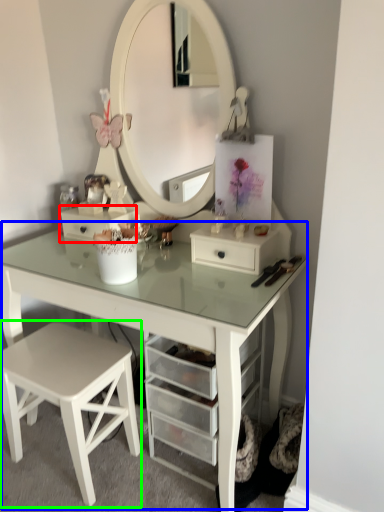
Question: Based on their relative distances, which object is nearer to drawer (highlighted by a red box)? Choose from table (highlighted by a blue box) and stool (highlighted by a green box).

Choices:
 (A) table
 (B) stool

Answer: (A)